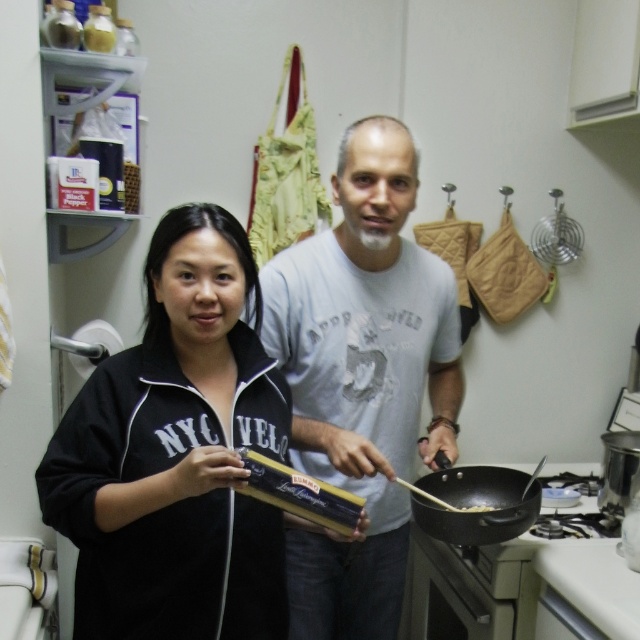
Question: Which object is closer to the camera taking this photo?

Choices:
 (A) black matte jacket at center
 (B) white cotton shirt at center

Answer: (A)

Question: Considering the relative positions of white cotton shirt at center and brown crispy noodles at pan right in the image provided, where is white cotton shirt at center located with respect to brown crispy noodles at pan right?

Choices:
 (A) left
 (B) right

Answer: (A)

Question: Which of the following is the farthest from the observer?

Choices:
 (A) black matte wok at center
 (B) black matte jacket at center

Answer: (A)

Question: Is white cotton shirt at center to the right of brown crispy noodles at pan right from the viewer's perspective?

Choices:
 (A) no
 (B) yes

Answer: (A)

Question: Which object appears closest to the camera in this image?

Choices:
 (A) black matte wok at center
 (B) brown crispy noodles at pan right
 (C) white cotton shirt at center
 (D) black matte jacket at center

Answer: (D)

Question: Is white cotton shirt at center closer to camera compared to brown crispy noodles at pan right?

Choices:
 (A) yes
 (B) no

Answer: (A)